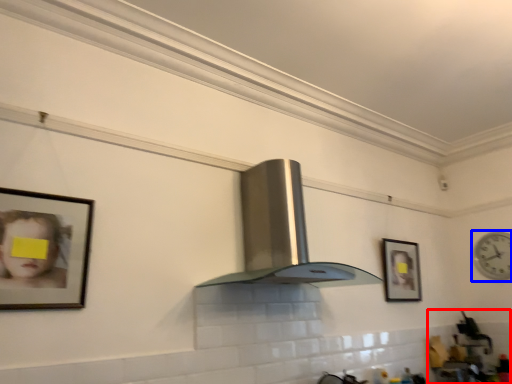
Question: Which object appears farthest to the camera in this image, sink (highlighted by a red box) or clock (highlighted by a blue box)?

Choices:
 (A) sink
 (B) clock

Answer: (B)